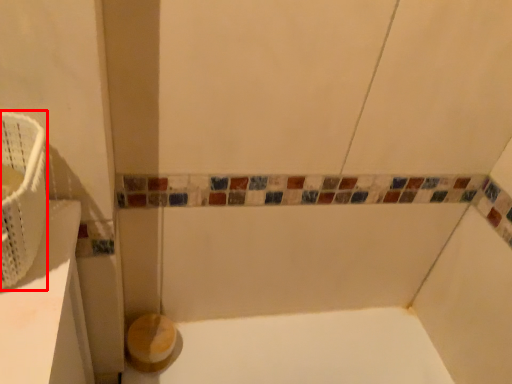
Question: From the image, what is the correct spatial relationship of basket (annotated by the red box) in relation to toilet paper?

Choices:
 (A) right
 (B) left

Answer: (B)